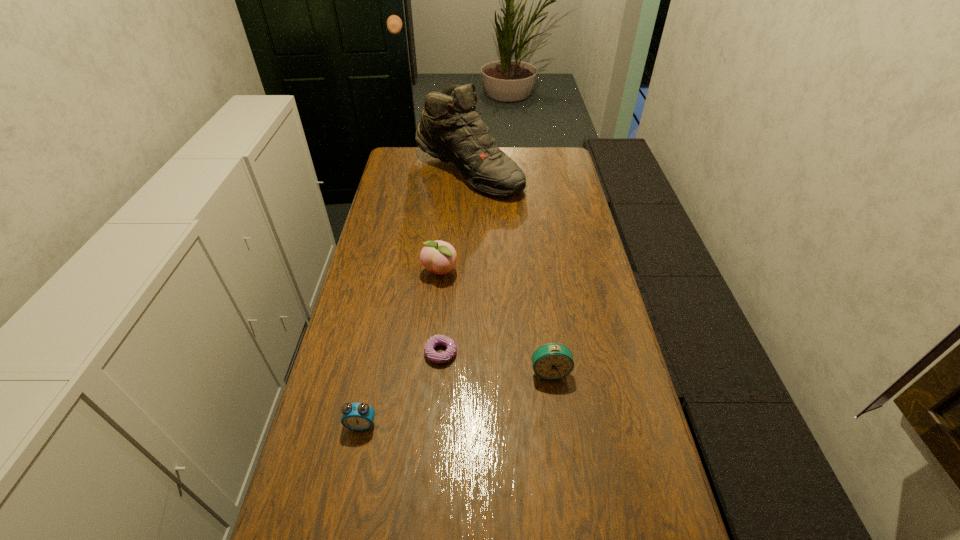
The height and width of the screenshot is (540, 960). I want to click on blank region between the doughnut and the fourth nearest object, so click(440, 313).

Locate an element on the screen. the fourth closest object to the peach is located at coordinates (355, 416).

Where is `object that is the fourth nearest to the fourth nearest object`? The image size is (960, 540). object that is the fourth nearest to the fourth nearest object is located at coordinates (355, 416).

Locate an element on the screen. free region that satisfies the following two spatial constraints: 1. on the front side of the peach; 2. on the left side of the shortest object is located at coordinates (432, 353).